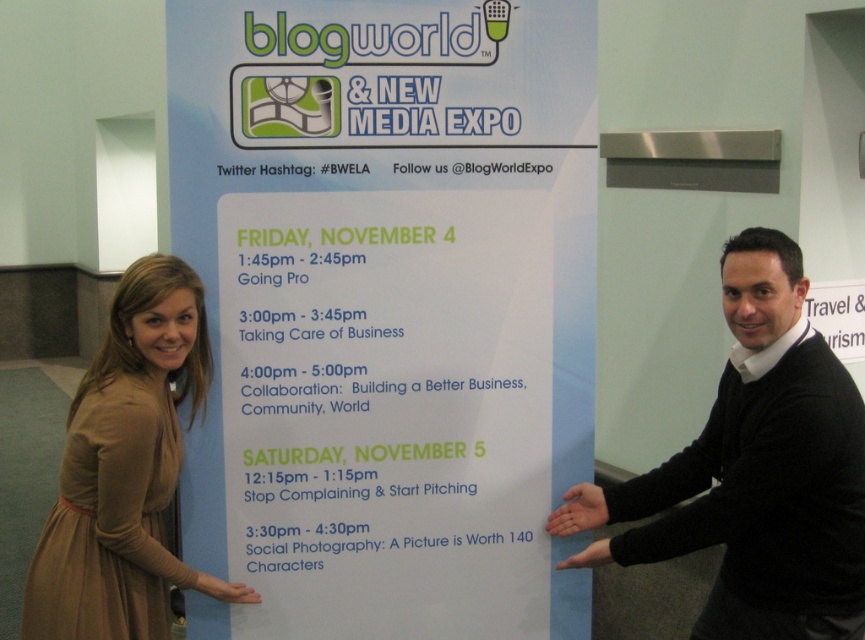
Question: Does white paper poster at center appear over brown fabric dress at lower left?

Choices:
 (A) no
 (B) yes

Answer: (B)

Question: Which point is farther to the camera?

Choices:
 (A) (136, 637)
 (B) (227, 484)
 (C) (725, 388)

Answer: (B)

Question: Which of the following is the farthest from the observer?

Choices:
 (A) brown fabric dress at lower left
 (B) white paper poster at center
 (C) black sweater at right

Answer: (B)

Question: Can you confirm if black sweater at right is thinner than brown fabric dress at lower left?

Choices:
 (A) yes
 (B) no

Answer: (B)

Question: Does black sweater at right have a larger size compared to brown fabric dress at lower left?

Choices:
 (A) no
 (B) yes

Answer: (B)

Question: Based on their relative distances, which object is farther from the white paper poster at center?

Choices:
 (A) black sweater at right
 (B) brown fabric dress at lower left

Answer: (A)